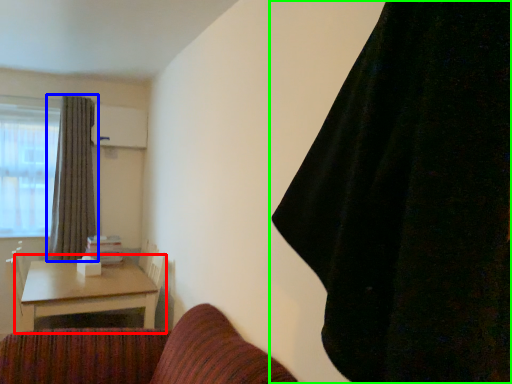
Question: Which is nearer to the table (highlighted by a red box)? curtain (highlighted by a blue box) or curtain (highlighted by a green box).

Choices:
 (A) curtain
 (B) curtain

Answer: (A)